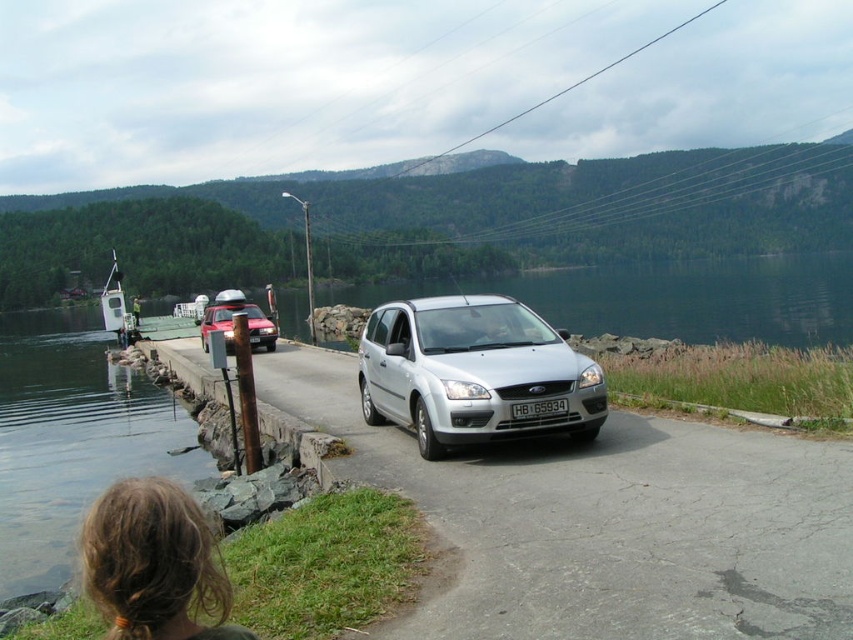
You are a photographer trying to capture the matte red car at left and the clear water at dock left in the same frame. Based on their positions, which object would appear larger in your photo?

The clear water at dock left appears larger in the photo because it is much taller than the matte red car at left.

You are standing at the lakeside and want to reach a specific location marked by the point at coordinates (74, 461). Given that your walking speed is 1.5 meters per second, approximately how many seconds will it take you to reach that point?

The point at coordinates (74, 461) is 15.52 meters away from the viewer. At a walking speed of 1.5 meters per second, it would take approximately 10.35 seconds to reach the point.

You are a photographer standing on the dock and want to capture both the clear water at dock left and the clear water at center in a single shot. Given that your camera has a maximum focal length of 50 meters, will you be able to include both areas in your photo?

The clear water at dock left is 55.42 meters from the clear water at center, which exceeds the camera maximum focal length of 50 meters. Therefore, you cannot include both areas in a single shot.